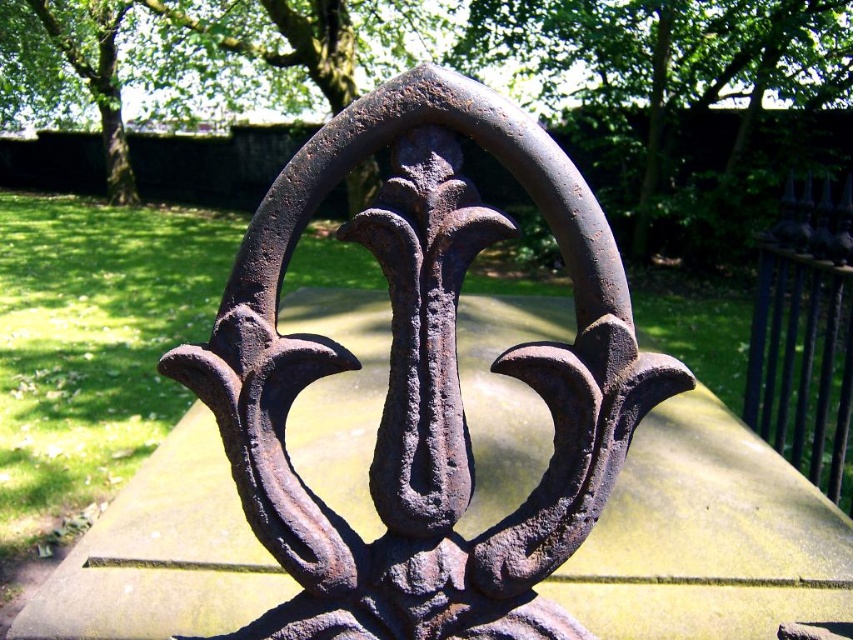
You are standing in front of an old wrought iron gate. You notice two points marked on the gate at coordinates point (x=183, y=362) and point (x=749, y=356). If you were to draw a straight line between these two points, would the line pass through the central leaf or flame motifs at the center of the gate?

The line between point (x=183, y=362) and point (x=749, y=356) would pass through the central leaf or flame motifs at the center of the gate because point (x=183, y=362) is in front of point (x=749, y=356), indicating they are aligned along the same vertical axis.

What are the coordinates of the rusty metal sculpture at center?

The coordinates of the rusty metal sculpture at center are at point (424, 380).